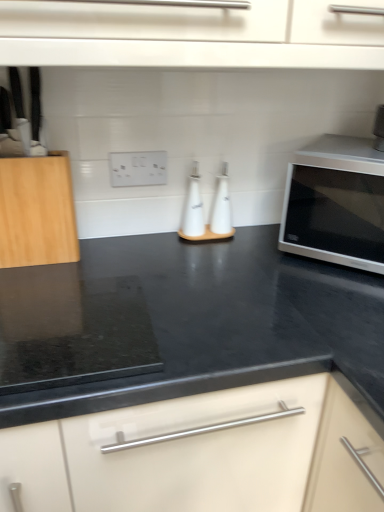
Describe the element at coordinates (336, 203) in the screenshot. I see `satin silver microwave at right` at that location.

Locate an element on the screen. This screenshot has width=384, height=512. white glossy bottle at center, placed as the first bottle when sorted from right to left is located at coordinates (221, 205).

Describe the element at coordinates (193, 207) in the screenshot. I see `white matte oil bottle at center, which ranks as the 2th bottle in right-to-left order` at that location.

The height and width of the screenshot is (512, 384). What are the coordinates of `satin silver microwave at right` in the screenshot? It's located at (336, 203).

From a real-world perspective, is white matte oil bottle at center, which ranks as the 2th bottle in right-to-left order, on white glossy bottle at center, the second bottle from the left?

Indeed, from a real-world perspective, white matte oil bottle at center, which ranks as the 2th bottle in right-to-left order, stands above white glossy bottle at center, the second bottle from the left.

Could you tell me if white matte oil bottle at center, which ranks as the 2th bottle in right-to-left order, is turned towards white glossy bottle at center, the second bottle from the left?

No, white matte oil bottle at center, which ranks as the 2th bottle in right-to-left order, does not turn towards white glossy bottle at center, the second bottle from the left.

Consider the image. Is white matte oil bottle at center, which is the 1th bottle in left-to-right order, taller or shorter than white glossy bottle at center, placed as the first bottle when sorted from right to left?

Clearly, white matte oil bottle at center, which is the 1th bottle in left-to-right order, is taller compared to white glossy bottle at center, placed as the first bottle when sorted from right to left.

Is white glossy bottle at center, placed as the first bottle when sorted from right to left, inside white matte oil bottle at center, which is the 1th bottle in left-to-right order?

No, white glossy bottle at center, placed as the first bottle when sorted from right to left, is located outside of white matte oil bottle at center, which is the 1th bottle in left-to-right order.

How distant is white plastic electric outlet at center from natural wood cutting board at left?

The distance of white plastic electric outlet at center from natural wood cutting board at left is 8.97 inches.

Considering the relative sizes of white plastic electric outlet at center and natural wood cutting board at left in the image provided, is white plastic electric outlet at center smaller than natural wood cutting board at left?

Yes.

Which object is closer to the camera, white plastic electric outlet at center or natural wood cutting board at left?

natural wood cutting board at left is closer to the camera.

From the picture: Is white plastic electric outlet at center not near natural wood cutting board at left?

white plastic electric outlet at center is near natural wood cutting board at left, not far away.

Considering the relative sizes of white plastic electric outlet at center and white matte oil bottle at center, which ranks as the 2th bottle in right-to-left order, in the image provided, is white plastic electric outlet at center taller than white matte oil bottle at center, which ranks as the 2th bottle in right-to-left order,?

No, white plastic electric outlet at center is not taller than white matte oil bottle at center, which ranks as the 2th bottle in right-to-left order.

Between white plastic electric outlet at center and white matte oil bottle at center, which ranks as the 2th bottle in right-to-left order, which one appears on the right side from the viewer's perspective?

white matte oil bottle at center, which ranks as the 2th bottle in right-to-left order.

From the image's perspective, does white plastic electric outlet at center appear higher than white matte oil bottle at center, which is the 1th bottle in left-to-right order?

Yes, from the image's perspective, white plastic electric outlet at center is over white matte oil bottle at center, which is the 1th bottle in left-to-right order.

Is satin silver microwave at right situated inside white plastic electric outlet at center or outside?

satin silver microwave at right cannot be found inside white plastic electric outlet at center.

Is satin silver microwave at right positioned with its back to white plastic electric outlet at center?

No, satin silver microwave at right is not facing the opposite direction of white plastic electric outlet at center.

Considering the sizes of objects satin silver microwave at right and white plastic electric outlet at center in the image provided, who is taller, satin silver microwave at right or white plastic electric outlet at center?

satin silver microwave at right is taller.

Looking at this image, from a real-world perspective, is satin silver microwave at right above or below white plastic electric outlet at center?

From a real-world perspective, satin silver microwave at right is physically below white plastic electric outlet at center.

This screenshot has width=384, height=512. Find the location of `electric outlet lying on the left of white glossy bottle at center, the second bottle from the left`. electric outlet lying on the left of white glossy bottle at center, the second bottle from the left is located at coordinates (138, 168).

Can you confirm if white glossy bottle at center, the second bottle from the left, is thinner than white plastic electric outlet at center?

No, white glossy bottle at center, the second bottle from the left, is not thinner than white plastic electric outlet at center.

Which point is more forward, (216, 199) or (154, 177)?

The point (154, 177) is closer.

Measure the distance between white glossy bottle at center, the second bottle from the left, and white plastic electric outlet at center.

white glossy bottle at center, the second bottle from the left, and white plastic electric outlet at center are 7.84 inches apart.

Looking at this image, from a real-world perspective, between white plastic electric outlet at center and white glossy bottle at center, placed as the first bottle when sorted from right to left, who is vertically lower?

white glossy bottle at center, placed as the first bottle when sorted from right to left, from a real-world perspective.

Is white plastic electric outlet at center positioned beyond the bounds of white glossy bottle at center, placed as the first bottle when sorted from right to left?

Yes, white plastic electric outlet at center is outside of white glossy bottle at center, placed as the first bottle when sorted from right to left.

Who is taller, white plastic electric outlet at center or white glossy bottle at center, placed as the first bottle when sorted from right to left?

Standing taller between the two is white glossy bottle at center, placed as the first bottle when sorted from right to left.

Looking at this image, is white plastic electric outlet at center oriented away from white glossy bottle at center, the second bottle from the left?

No.

Considering the relative positions of white glossy bottle at center, placed as the first bottle when sorted from right to left, and white matte oil bottle at center, which ranks as the 2th bottle in right-to-left order, in the image provided, is white glossy bottle at center, placed as the first bottle when sorted from right to left, behind white matte oil bottle at center, which ranks as the 2th bottle in right-to-left order,?

Yes, white glossy bottle at center, placed as the first bottle when sorted from right to left, is further from the viewer.

Is white glossy bottle at center, placed as the first bottle when sorted from right to left, taller than white matte oil bottle at center, which is the 1th bottle in left-to-right order?

No, white glossy bottle at center, placed as the first bottle when sorted from right to left, is not taller than white matte oil bottle at center, which is the 1th bottle in left-to-right order.

Looking at their sizes, would you say white glossy bottle at center, the second bottle from the left, is wider or thinner than white matte oil bottle at center, which is the 1th bottle in left-to-right order?

Considering their sizes, white glossy bottle at center, the second bottle from the left, looks broader than white matte oil bottle at center, which is the 1th bottle in left-to-right order.

Is white glossy bottle at center, the second bottle from the left, looking in the opposite direction of white matte oil bottle at center, which ranks as the 2th bottle in right-to-left order?

No, white glossy bottle at center, the second bottle from the left, is not facing away from white matte oil bottle at center, which ranks as the 2th bottle in right-to-left order.

At what (x,y) coordinates should I click in order to perform the action: click on bottle in front of the white glossy bottle at center, placed as the first bottle when sorted from right to left. Please return your answer as a coordinate pair (x, y). Looking at the image, I should click on (193, 207).

The height and width of the screenshot is (512, 384). I want to click on electric outlet behind the natural wood cutting board at left, so click(x=138, y=168).

Estimate the real-world distances between objects in this image. Which object is further from white plastic electric outlet at center, natural wood cutting board at left or satin silver microwave at right?

satin silver microwave at right is further to white plastic electric outlet at center.

Which object lies nearer to the anchor point satin silver microwave at right, natural wood cutting board at left or white matte oil bottle at center, which is the 1th bottle in left-to-right order?

white matte oil bottle at center, which is the 1th bottle in left-to-right order, is positioned closer to the anchor satin silver microwave at right.

Estimate the real-world distances between objects in this image. Which object is further from natural wood cutting board at left, white glossy bottle at center, placed as the first bottle when sorted from right to left, or satin silver microwave at right?

satin silver microwave at right lies further to natural wood cutting board at left than the other object.

From the image, which object appears to be nearer to satin silver microwave at right, white glossy bottle at center, placed as the first bottle when sorted from right to left, or white plastic electric outlet at center?

white glossy bottle at center, placed as the first bottle when sorted from right to left, lies closer to satin silver microwave at right than the other object.

Estimate the real-world distances between objects in this image. Which object is closer to satin silver microwave at right, white matte oil bottle at center, which is the 1th bottle in left-to-right order, or white glossy bottle at center, the second bottle from the left?

white glossy bottle at center, the second bottle from the left, is positioned closer to the anchor satin silver microwave at right.

When comparing their distances from satin silver microwave at right, does white plastic electric outlet at center or white glossy bottle at center, placed as the first bottle when sorted from right to left, seem closer?

Based on the image, white glossy bottle at center, placed as the first bottle when sorted from right to left, appears to be nearer to satin silver microwave at right.

Based on their spatial positions, is white matte oil bottle at center, which ranks as the 2th bottle in right-to-left order, or natural wood cutting board at left closer to satin silver microwave at right?

white matte oil bottle at center, which ranks as the 2th bottle in right-to-left order, lies closer to satin silver microwave at right than the other object.

Which object lies further to the anchor point white matte oil bottle at center, which ranks as the 2th bottle in right-to-left order, white glossy bottle at center, placed as the first bottle when sorted from right to left, or white plastic electric outlet at center?

Based on the image, white plastic electric outlet at center appears to be further to white matte oil bottle at center, which ranks as the 2th bottle in right-to-left order.

Where is `electric outlet located between natural wood cutting board at left and white matte oil bottle at center, which is the 1th bottle in left-to-right order, in the left-right direction`? Image resolution: width=384 pixels, height=512 pixels. electric outlet located between natural wood cutting board at left and white matte oil bottle at center, which is the 1th bottle in left-to-right order, in the left-right direction is located at coordinates (138, 168).

This screenshot has width=384, height=512. I want to click on electric outlet between natural wood cutting board at left and white glossy bottle at center, the second bottle from the left, so click(x=138, y=168).

The width and height of the screenshot is (384, 512). I want to click on bottle between natural wood cutting board at left and white glossy bottle at center, placed as the first bottle when sorted from right to left, from left to right, so click(193, 207).

You are a GUI agent. You are given a task and a screenshot of the screen. Output one action in this format:
    pyautogui.click(x=<x>, y=<y>)
    Task: Click on the bottle located between white matte oil bottle at center, which is the 1th bottle in left-to-right order, and satin silver microwave at right in the left-right direction
    The height and width of the screenshot is (512, 384).
    Given the screenshot: What is the action you would take?
    pyautogui.click(x=221, y=205)